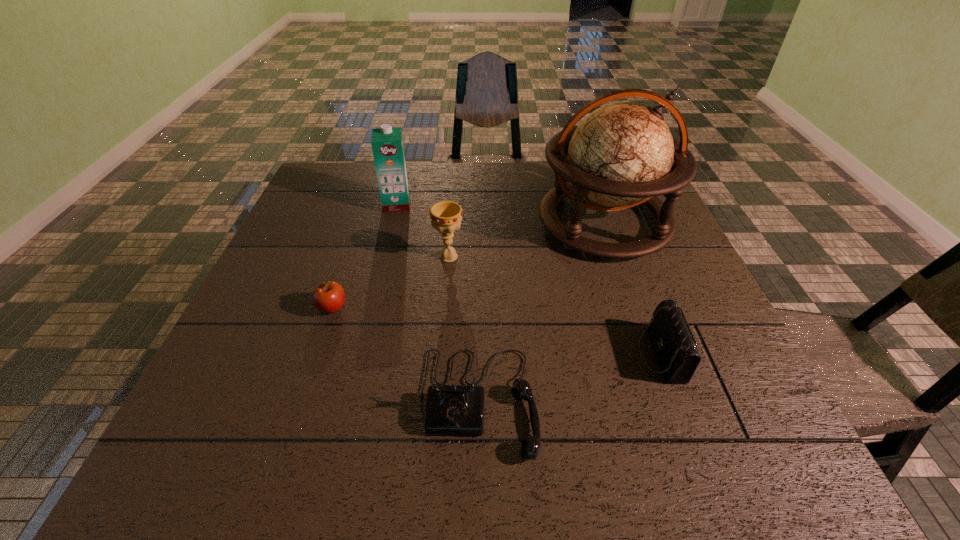
Image resolution: width=960 pixels, height=540 pixels. Identify the location of clutch bag that is positioned at the right edge. (674, 344).

This screenshot has height=540, width=960. I want to click on object at the far right corner, so click(620, 156).

Where is `blank space at the far edge`? blank space at the far edge is located at coordinates (484, 202).

The image size is (960, 540). In the image, there is a desktop. Identify the location of vacant space at the left edge. (315, 233).

At what (x,y) coordinates should I click in order to perform the action: click on vacant space at the right edge of the desktop. Please return your answer as a coordinate pair (x, y). The height and width of the screenshot is (540, 960). Looking at the image, I should click on (620, 230).

This screenshot has height=540, width=960. In order to click on blank area at the near left corner in this screenshot , I will do `click(264, 446)`.

Where is `vacant space that is in between the telephone and the second tallest object`? The image size is (960, 540). vacant space that is in between the telephone and the second tallest object is located at coordinates (438, 303).

Where is `free space between the telephone and the chalice`? free space between the telephone and the chalice is located at coordinates (464, 329).

The width and height of the screenshot is (960, 540). In order to click on free space between the tallest object and the fifth shortest object in this screenshot , I will do [500, 214].

I want to click on unoccupied area between the tallest object and the carton, so click(500, 214).